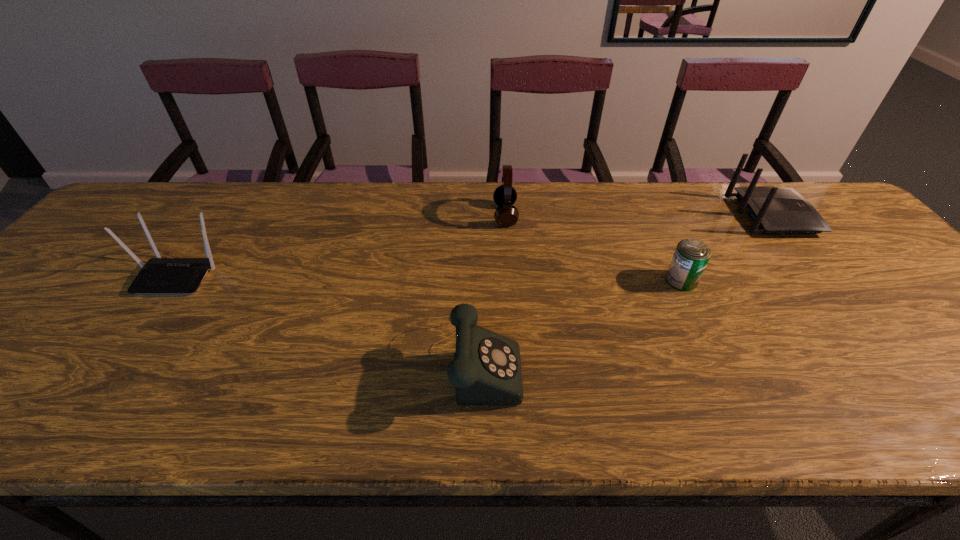
The image size is (960, 540). I want to click on vacant space that satisfies the following two spatial constraints: 1. on the ear pads of the headset; 2. on the front-facing side of the farther router, so click(505, 215).

Find the location of a particular element. This screenshot has width=960, height=540. vacant region that satisfies the following two spatial constraints: 1. on the ear pads of the headset; 2. on the front-facing side of the left router is located at coordinates (510, 274).